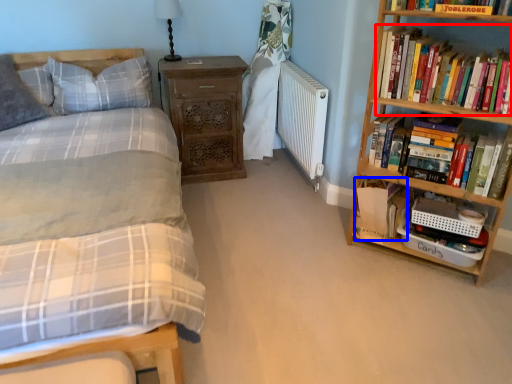
Question: Which point is further to the camera, book (highlighted by a red box) or book (highlighted by a blue box)?

Choices:
 (A) book
 (B) book

Answer: (B)